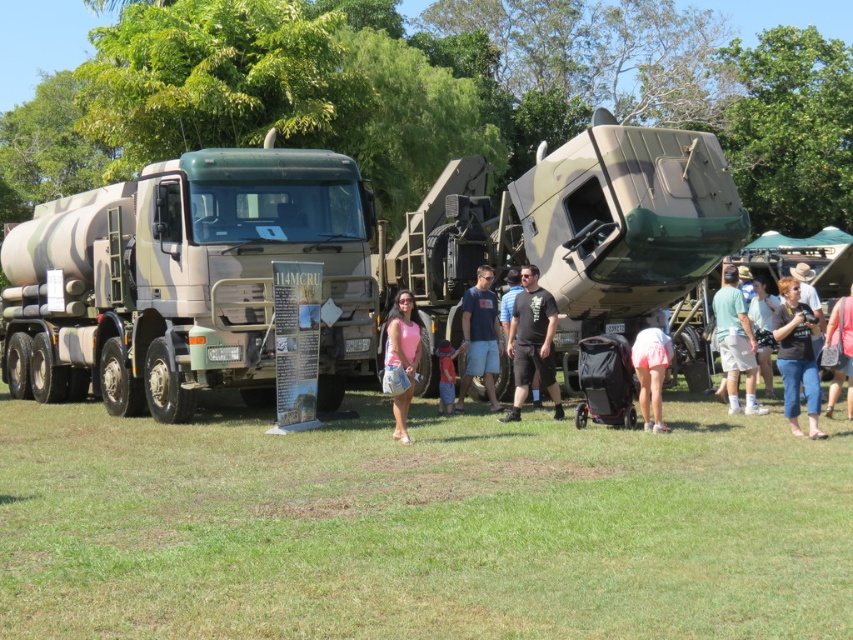
Question: Which of these objects is positioned closest to the green grass at center?

Choices:
 (A) red fabric shirt at center
 (B) camouflage fabric missile launcher at center

Answer: (A)

Question: Is dark blue t-shirt at center closer to camera compared to pink fabric dress at center?

Choices:
 (A) yes
 (B) no

Answer: (B)

Question: Does black matte t-shirt at center appear on the right side of pink fabric dress at center?

Choices:
 (A) yes
 (B) no

Answer: (A)

Question: Which of the following is the farthest from the observer?

Choices:
 (A) (461, 328)
 (B) (850, 296)
 (C) (639, 376)
 (D) (784, 365)

Answer: (A)

Question: Does green grass at center have a greater width compared to light brown leather jacket at center?

Choices:
 (A) yes
 (B) no

Answer: (A)

Question: Which of the following is the closest to the observer?

Choices:
 (A) red fabric shirt at center
 (B) camouflage paint truck at center
 (C) camouflage fabric missile launcher at center

Answer: (A)